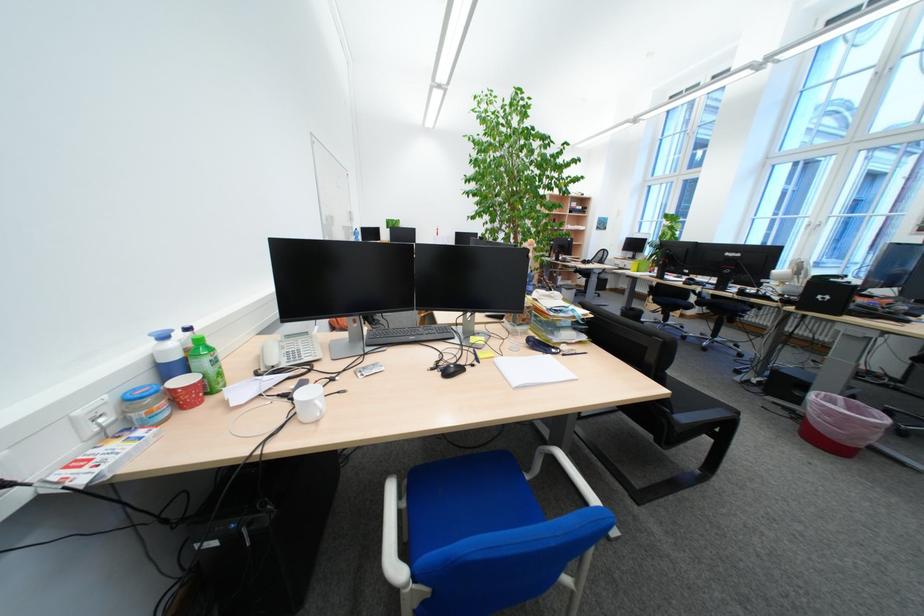
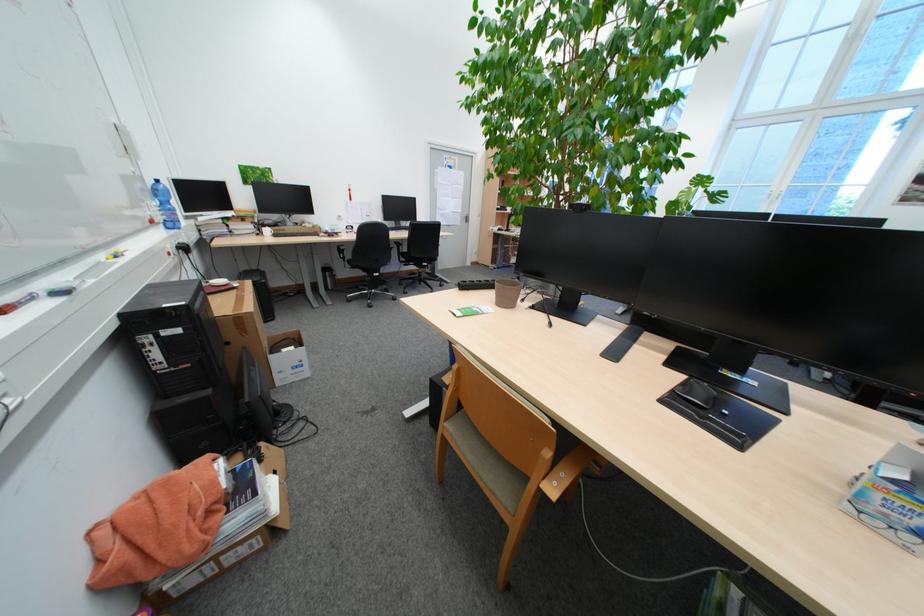
Which direction would the cameraman need to move to produce the second image?

The cameraman moved toward left, forward.